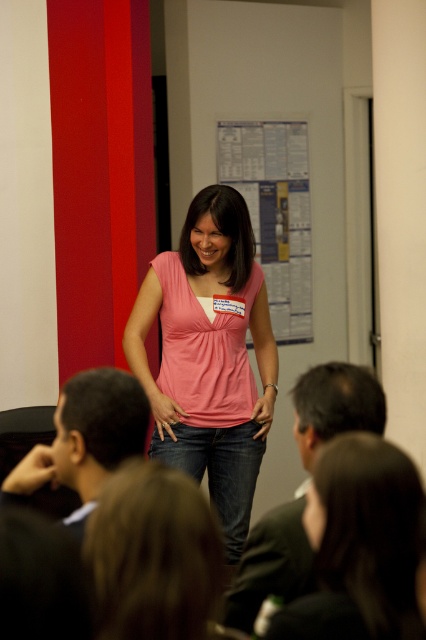
Question: Which object is the farthest from the white paperboard at center?

Choices:
 (A) pink matte shirt at center
 (B) pink matte tank top at center

Answer: (A)

Question: Estimate the real-world distances between objects in this image. Which object is closer to the pink matte tank top at center?

Choices:
 (A) white paperboard at center
 (B) pink matte shirt at center

Answer: (A)

Question: Among these objects, which one is farthest from the camera?

Choices:
 (A) pink matte shirt at center
 (B) pink matte tank top at center
 (C) white paperboard at center

Answer: (C)

Question: Is pink matte shirt at center to the right of white paperboard at center from the viewer's perspective?

Choices:
 (A) no
 (B) yes

Answer: (A)

Question: Can you confirm if pink matte shirt at center is positioned above white paperboard at center?

Choices:
 (A) no
 (B) yes

Answer: (A)

Question: Can you confirm if pink matte shirt at center is wider than white paperboard at center?

Choices:
 (A) no
 (B) yes

Answer: (A)